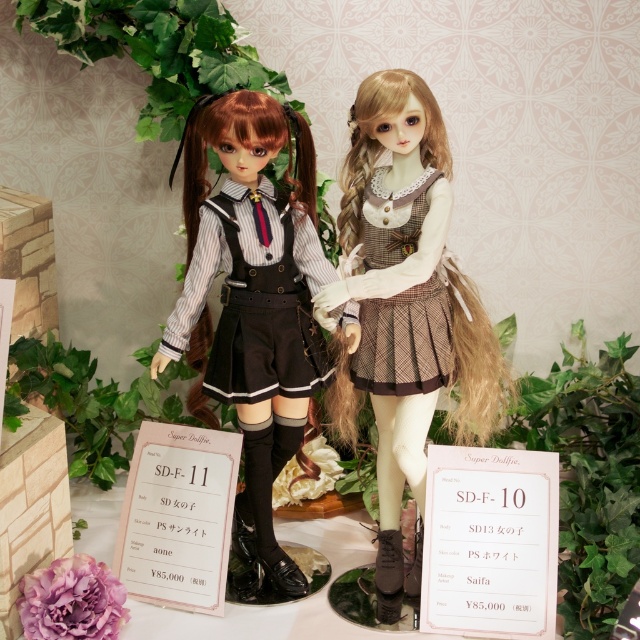
Image resolution: width=640 pixels, height=640 pixels. What do you see at coordinates (406, 304) in the screenshot? I see `brown plaid dress at center` at bounding box center [406, 304].

Who is positioned more to the left, brown plaid dress at center or plaid fabric dress at center?

plaid fabric dress at center is more to the left.

I want to click on brown plaid dress at center, so click(x=406, y=304).

Between point (253, 444) and point (220, 252), which one is positioned in front?

Point (220, 252)

Between point (307, 220) and point (230, 380), which one is positioned behind?

Positioned behind is point (307, 220).

In order to click on matte black uniform at center in this screenshot , I will do `click(253, 296)`.

Who is higher up, matte black uniform at center or plaid fabric dress at center?

plaid fabric dress at center

Is point (260, 512) closer to camera compared to point (387, 236)?

That is False.

At what (x,y) coordinates should I click in order to perform the action: click on matte black uniform at center. Please return your answer as a coordinate pair (x, y). This screenshot has width=640, height=640. Looking at the image, I should click on (253, 296).